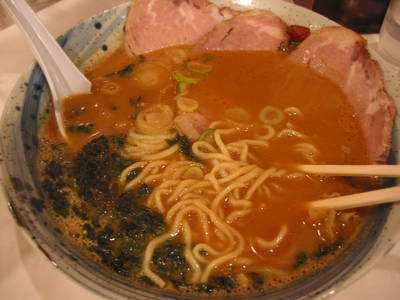
The height and width of the screenshot is (300, 400). I want to click on bowl, so click(288, 14).